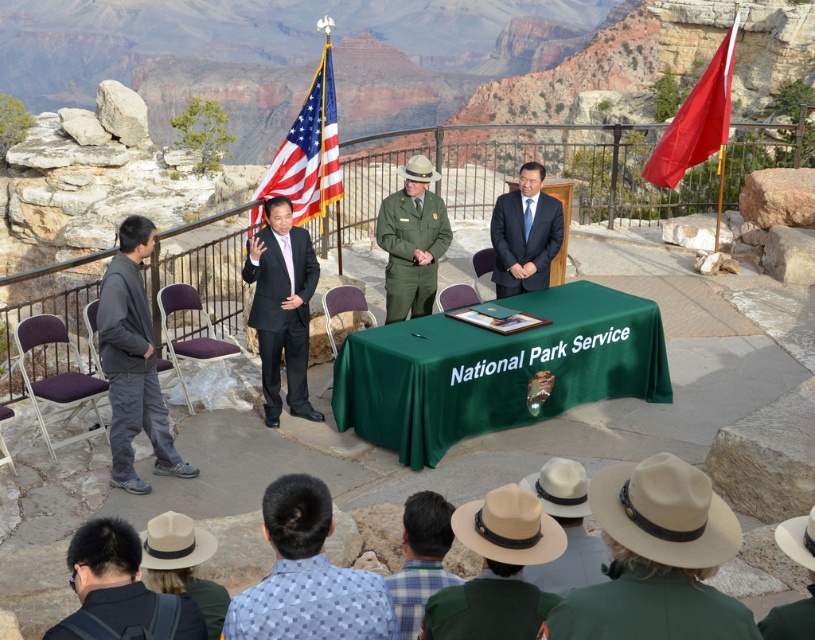
Can you confirm if dark gray fabric pants at left is shorter than beige felt hat at lower center?

Incorrect, dark gray fabric pants at left's height does not fall short of beige felt hat at lower center's.

Which is behind, point (148, 352) or point (95, 608)?

The point (148, 352) is more distant.

Where is `dark gray fabric pants at left`? This screenshot has width=815, height=640. dark gray fabric pants at left is located at coordinates (131, 362).

Can you confirm if brown felt hat at center is taller than brown felt hat at lower center?

Yes.

Which is more to the right, brown felt hat at center or brown felt hat at lower center?

brown felt hat at lower center

Which is in front, point (491, 582) or point (767, 614)?

Point (767, 614)

Find the location of a particular element. This screenshot has width=815, height=640. brown felt hat at center is located at coordinates (496, 570).

Who is positioned more to the left, american flag at upper center or beige straw hat at center?

american flag at upper center is more to the left.

Does american flag at upper center appear over beige straw hat at center?

Yes.

Is point (296, 212) closer to camera compared to point (587, 573)?

No, (296, 212) is behind (587, 573).

I want to click on american flag at upper center, so click(307, 150).